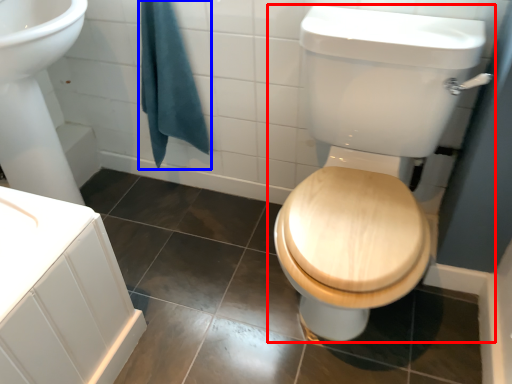
Question: Which of the following is the farthest to the observer, toilet (highlighted by a red box) or bath towel (highlighted by a blue box)?

Choices:
 (A) toilet
 (B) bath towel

Answer: (B)